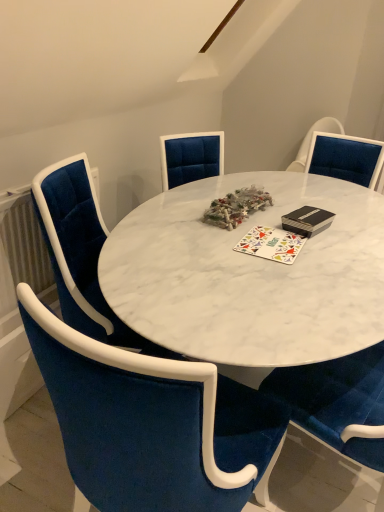
Locate an element on the screen. This screenshot has height=512, width=384. spots to the right of multicolored fabric mat at center is located at coordinates (323, 249).